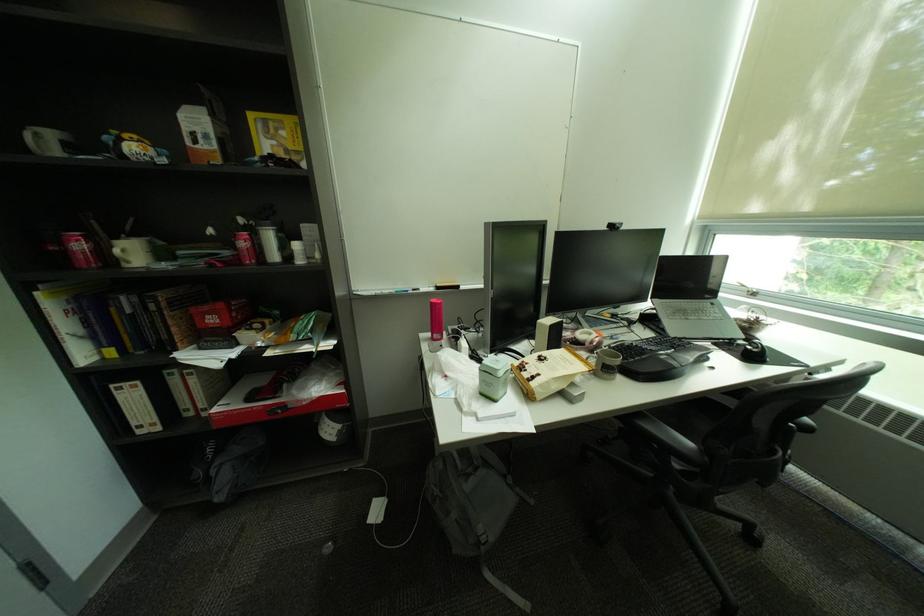
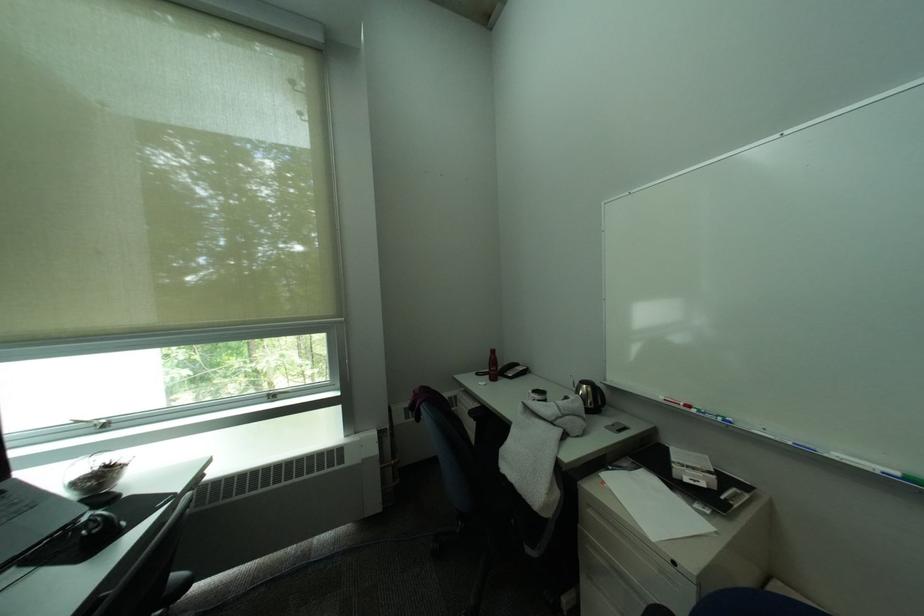
Question: The camera is either moving clockwise (left) or counter-clockwise (right) around the object. The first image is from the beginning of the video and the second image is from the end. Is the camera moving left or right when shooting the video?

Choices:
 (A) Left
 (B) Right

Answer: (A)